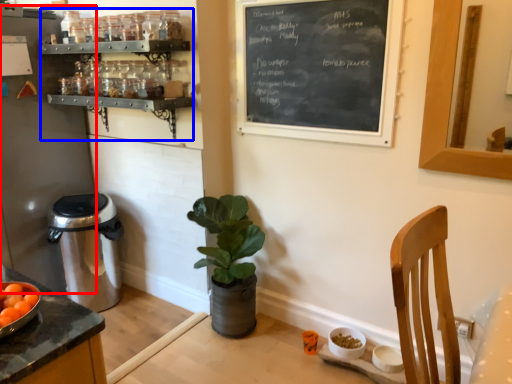
Question: Which object is further to the camera taking this photo, appliance (highlighted by a red box) or shelf (highlighted by a blue box)?

Choices:
 (A) appliance
 (B) shelf

Answer: (A)